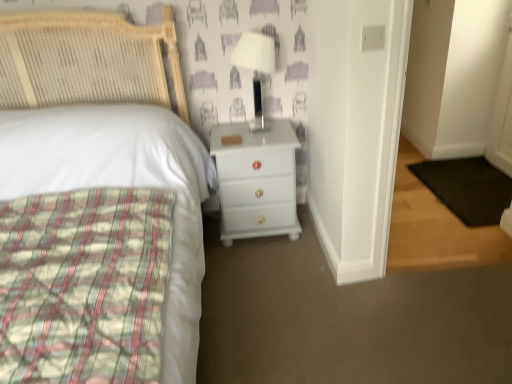
Question: Considering the relative sizes of white glossy chest of drawers at center and white glossy lamp at upper right in the image provided, is white glossy chest of drawers at center bigger than white glossy lamp at upper right?

Choices:
 (A) no
 (B) yes

Answer: (B)

Question: Is white glossy lamp at upper right a part of white glossy chest of drawers at center?

Choices:
 (A) yes
 (B) no

Answer: (B)

Question: From the image's perspective, is white glossy chest of drawers at center on top of white glossy lamp at upper right?

Choices:
 (A) no
 (B) yes

Answer: (A)

Question: Could you tell me if white glossy chest of drawers at center is turned towards white glossy lamp at upper right?

Choices:
 (A) no
 (B) yes

Answer: (A)

Question: Is there a large distance between white glossy chest of drawers at center and white glossy lamp at upper right?

Choices:
 (A) no
 (B) yes

Answer: (A)

Question: Is point (42, 76) closer or farther from the camera than point (254, 72)?

Choices:
 (A) farther
 (B) closer

Answer: (B)

Question: From the image's perspective, is white woven headboard at upper left above or below white glossy lamp at upper right?

Choices:
 (A) above
 (B) below

Answer: (B)

Question: Is white woven headboard at upper left spatially inside white glossy lamp at upper right, or outside of it?

Choices:
 (A) outside
 (B) inside

Answer: (A)

Question: From a real-world perspective, is white woven headboard at upper left above or below white glossy lamp at upper right?

Choices:
 (A) below
 (B) above

Answer: (A)

Question: From the image's perspective, is white glossy lamp at upper right positioned above or below white woven headboard at upper left?

Choices:
 (A) below
 (B) above

Answer: (B)

Question: Is white glossy lamp at upper right taller or shorter than white woven headboard at upper left?

Choices:
 (A) tall
 (B) short

Answer: (B)

Question: From a real-world perspective, is white glossy lamp at upper right positioned above or below white woven headboard at upper left?

Choices:
 (A) above
 (B) below

Answer: (A)

Question: Is white glossy lamp at upper right inside or outside of white woven headboard at upper left?

Choices:
 (A) outside
 (B) inside

Answer: (A)

Question: From the image's perspective, is white woven headboard at upper left positioned above or below white glossy chest of drawers at center?

Choices:
 (A) below
 (B) above

Answer: (A)

Question: Is point (53, 76) positioned closer to the camera than point (271, 153)?

Choices:
 (A) closer
 (B) farther

Answer: (B)